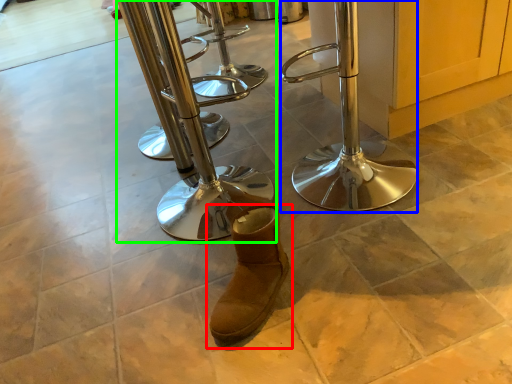
Question: Based on their relative distances, which object is farther from footwear (highlighted by a red box)? Choose from step stool (highlighted by a blue box) and step stool (highlighted by a green box).

Choices:
 (A) step stool
 (B) step stool

Answer: (B)